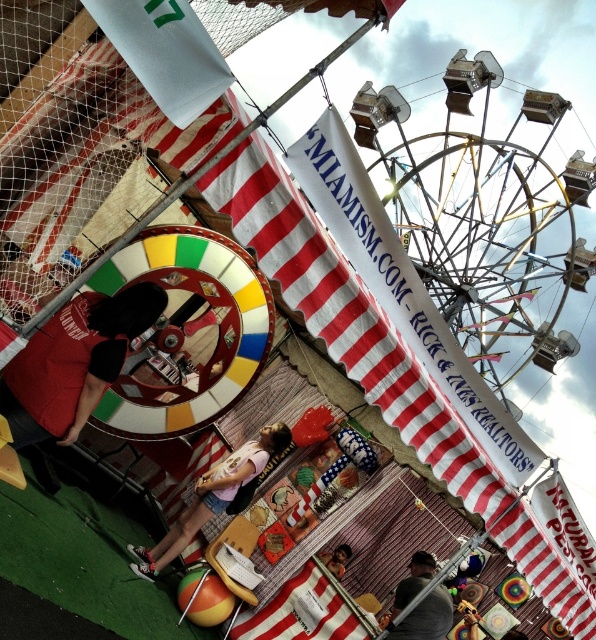
Is matte red shirt at left thinner than pink fabric at center?

Yes.

Measure the distance between matte red shirt at left and pink fabric at center.

The distance of matte red shirt at left from pink fabric at center is 19.28 meters.

Identify the location of matte red shirt at left. (73, 362).

Does matte red shirt at left have a greater width compared to dark gray shirt at lower center?

Indeed, matte red shirt at left has a greater width compared to dark gray shirt at lower center.

Does matte red shirt at left appear over dark gray shirt at lower center?

Correct, matte red shirt at left is located above dark gray shirt at lower center.

Does point (97, 388) come in front of point (418, 588)?

Yes, point (97, 388) is closer to viewer.

This screenshot has height=640, width=596. In order to click on matte red shirt at left in this screenshot , I will do `click(73, 362)`.

Does metallic ferris wheel at upper center have a larger size compared to matte red shirt at left?

Correct, metallic ferris wheel at upper center is larger in size than matte red shirt at left.

You are a GUI agent. You are given a task and a screenshot of the screen. Output one action in this format:
    pyautogui.click(x=<x>, y=<y>)
    Task: Click on the metallic ferris wheel at upper center
    
    Given the screenshot: What is the action you would take?
    pyautogui.click(x=485, y=221)

You are a GUI agent. You are given a task and a screenshot of the screen. Output one action in this format:
    pyautogui.click(x=<x>, y=<y>)
    Task: Click on the metallic ferris wheel at upper center
    The height and width of the screenshot is (640, 596).
    Given the screenshot: What is the action you would take?
    pyautogui.click(x=485, y=221)